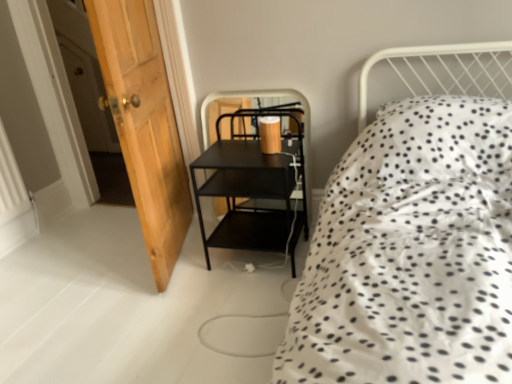
Question: Is wooden door at left not near black metal shelf at center?

Choices:
 (A) yes
 (B) no

Answer: (B)

Question: Does wooden door at left lie in front of black metal shelf at center?

Choices:
 (A) no
 (B) yes

Answer: (B)

Question: Would you say black metal shelf at center is part of wooden door at left's contents?

Choices:
 (A) yes
 (B) no

Answer: (B)

Question: Is wooden door at left further to camera compared to black metal shelf at center?

Choices:
 (A) no
 (B) yes

Answer: (A)

Question: Is wooden door at left touching black metal shelf at center?

Choices:
 (A) no
 (B) yes

Answer: (A)

Question: Is wooden door at left facing away from black metal shelf at center?

Choices:
 (A) yes
 (B) no

Answer: (B)

Question: Is wooden door at left inside black metal shelf at center?

Choices:
 (A) yes
 (B) no

Answer: (B)

Question: Is black metal shelf at center facing towards wooden door at left?

Choices:
 (A) no
 (B) yes

Answer: (A)

Question: Is black metal shelf at center smaller than wooden door at left?

Choices:
 (A) yes
 (B) no

Answer: (A)

Question: Is black metal shelf at center oriented away from wooden door at left?

Choices:
 (A) no
 (B) yes

Answer: (A)

Question: Is black metal shelf at center not near wooden door at left?

Choices:
 (A) yes
 (B) no

Answer: (B)

Question: Considering the relative sizes of black metal shelf at center and wooden door at left in the image provided, is black metal shelf at center wider than wooden door at left?

Choices:
 (A) no
 (B) yes

Answer: (A)

Question: Which is correct: wooden door at left is inside black metal shelf at center, or outside of it?

Choices:
 (A) outside
 (B) inside

Answer: (A)